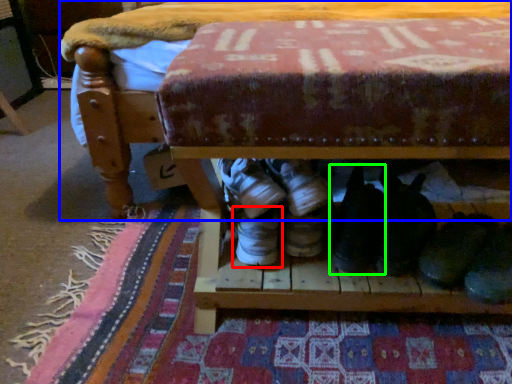
Question: Estimate the real-world distances between objects in this image. Which object is closer to footwear (highlighted by a red box), furniture (highlighted by a blue box) or footwear (highlighted by a green box)?

Choices:
 (A) furniture
 (B) footwear

Answer: (B)